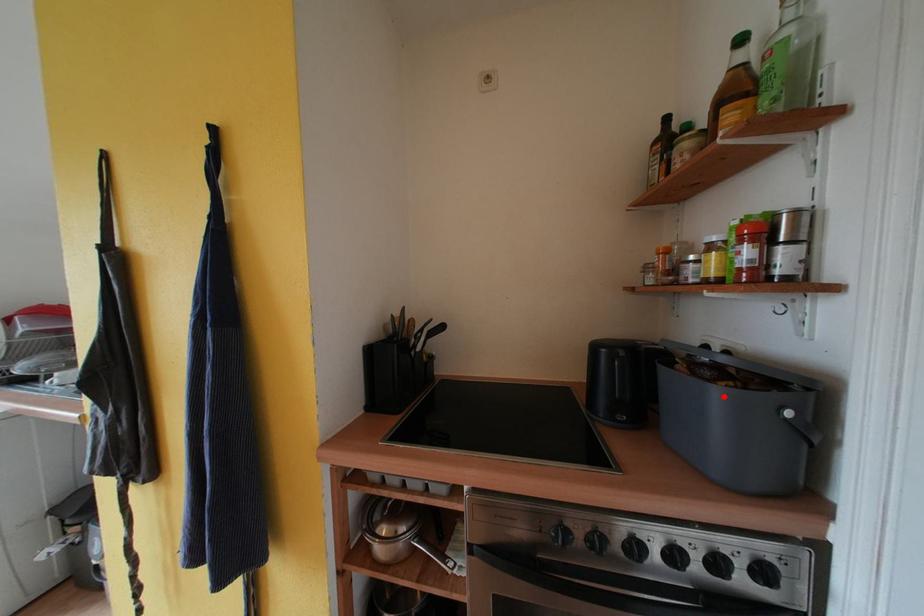
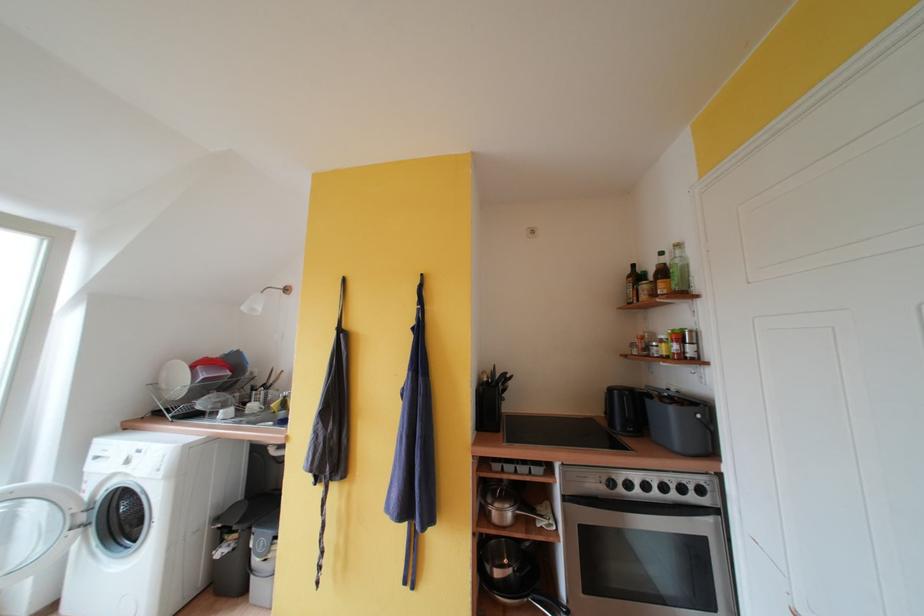
Locate, in the second image, the point that corresponds to the highlighted location in the first image.

(678, 413)